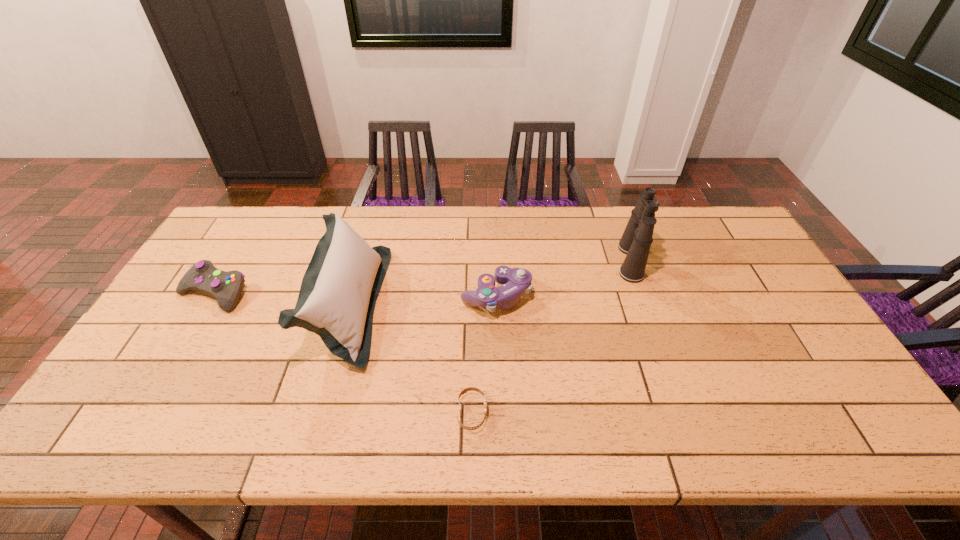
Where is `binoculars`? The image size is (960, 540). binoculars is located at coordinates (636, 240).

Find the location of a particular element. This screenshot has width=960, height=540. the tallest object is located at coordinates (636, 240).

You are a GUI agent. You are given a task and a screenshot of the screen. Output one action in this format:
    pyautogui.click(x=<x>, y=<y>)
    Task: Click on the cushion
    This screenshot has width=960, height=540.
    Given the screenshot: What is the action you would take?
    pyautogui.click(x=337, y=297)

Identify the location of the fourth object from right to left. (337, 297).

Find the location of `the third shortest object`. the third shortest object is located at coordinates (515, 281).

Locate an element on the screen. The height and width of the screenshot is (540, 960). the right control is located at coordinates (515, 281).

In order to click on the second shortest object in this screenshot , I will do `click(203, 277)`.

Locate an element on the screen. This screenshot has width=960, height=540. the shorter control is located at coordinates (203, 277).

What are the coordinates of `watch` in the screenshot? It's located at coord(464,390).

Where is `the shortest object`? the shortest object is located at coordinates pyautogui.click(x=464, y=390).